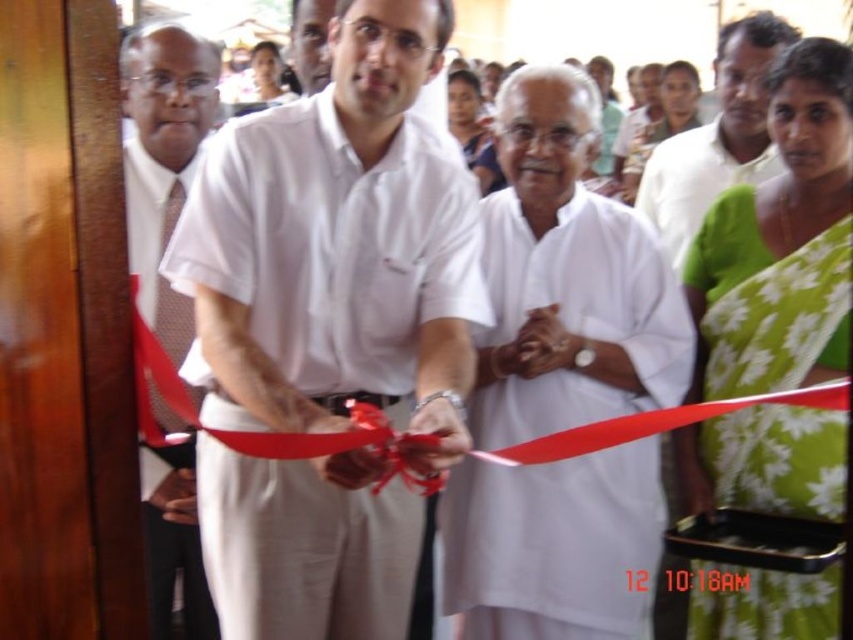
Based on the photo, between white smooth shirt at center and green floral saree at right, which one is positioned lower?

green floral saree at right is below.

Is white smooth shirt at center bigger than green floral saree at right?

Indeed, white smooth shirt at center has a larger size compared to green floral saree at right.

Where is `white smooth shirt at center`? This screenshot has width=853, height=640. white smooth shirt at center is located at coordinates (338, 248).

Between point (689, 268) and point (772, 16), which one is positioned behind?

Positioned behind is point (772, 16).

Consider the image. Which is above, green floral saree at right or white cotton shirt at center?

white cotton shirt at center is higher up.

This screenshot has height=640, width=853. What do you see at coordinates (781, 243) in the screenshot?
I see `green floral saree at right` at bounding box center [781, 243].

Locate an element on the screen. The height and width of the screenshot is (640, 853). green floral saree at right is located at coordinates (781, 243).

Is white cotton kurta at center closer to camera compared to matte brown tie at left?

Yes, white cotton kurta at center is in front of matte brown tie at left.

Does white cotton kurta at center have a smaller size compared to matte brown tie at left?

Incorrect, white cotton kurta at center is not smaller in size than matte brown tie at left.

The height and width of the screenshot is (640, 853). Describe the element at coordinates (567, 276) in the screenshot. I see `white cotton kurta at center` at that location.

Where is `white cotton kurta at center`? white cotton kurta at center is located at coordinates (567, 276).